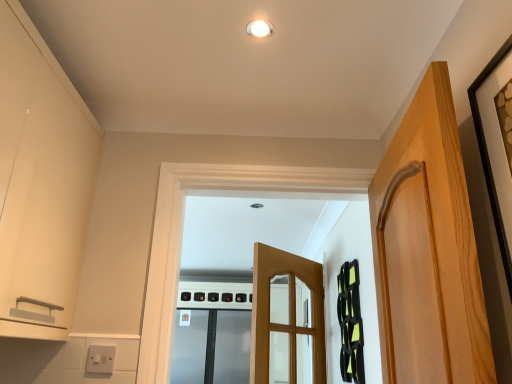
I want to click on free point to the right of white glossy light fixture at upper center, so click(315, 31).